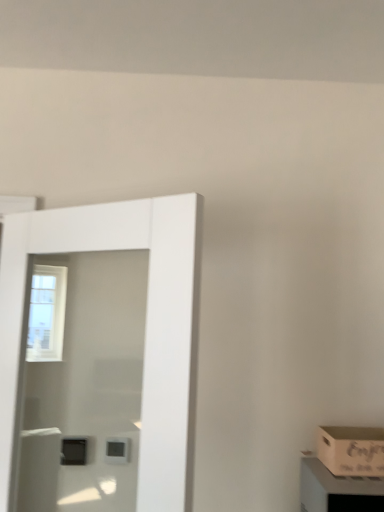
Question: Is point (301, 495) closer or farther from the camera than point (339, 460)?

Choices:
 (A) farther
 (B) closer

Answer: (A)

Question: From the image's perspective, is wooden crate at lower right above or below wooden box at lower right?

Choices:
 (A) below
 (B) above

Answer: (A)

Question: Based on their relative distances, which object is farther from the wooden crate at lower right?

Choices:
 (A) wooden box at lower right
 (B) white glossy door at left

Answer: (B)

Question: Considering the real-world distances, which object is closest to the white glossy door at left?

Choices:
 (A) wooden box at lower right
 (B) wooden crate at lower right

Answer: (B)